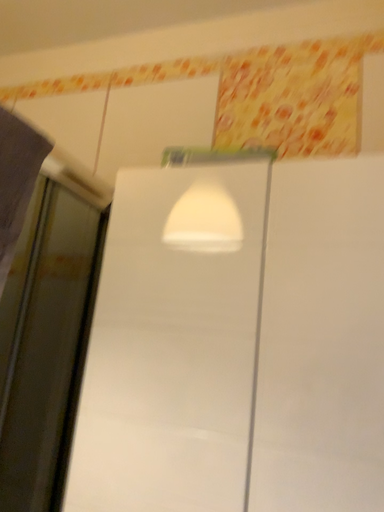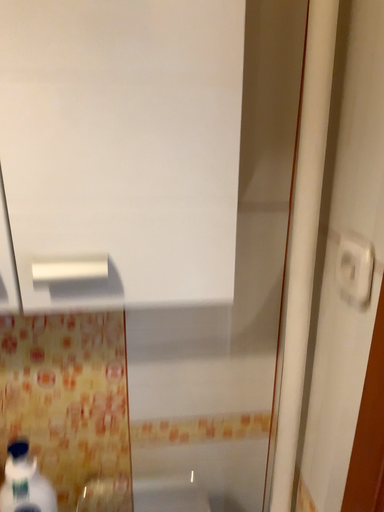
Question: Which way did the camera rotate in the video?

Choices:
 (A) rotated upward
 (B) rotated downward

Answer: (B)